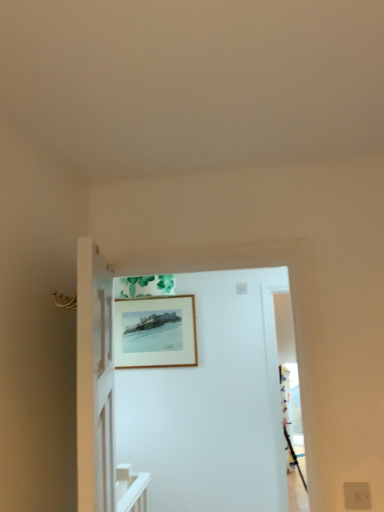
Question: Does white wooden door at center appear on the left side of white matte electric outlet at lower right?

Choices:
 (A) no
 (B) yes

Answer: (B)

Question: Considering the relative sizes of white wooden door at center and white matte electric outlet at lower right in the image provided, is white wooden door at center bigger than white matte electric outlet at lower right?

Choices:
 (A) no
 (B) yes

Answer: (B)

Question: Does white wooden door at center have a greater width compared to white matte electric outlet at lower right?

Choices:
 (A) no
 (B) yes

Answer: (B)

Question: Is white wooden door at center further to camera compared to white matte electric outlet at lower right?

Choices:
 (A) yes
 (B) no

Answer: (A)

Question: From the image's perspective, would you say white wooden door at center is shown under white matte electric outlet at lower right?

Choices:
 (A) yes
 (B) no

Answer: (B)

Question: In terms of width, does white wooden door at center look wider or thinner when compared to white matte electric outlet at lower right?

Choices:
 (A) wide
 (B) thin

Answer: (A)

Question: From the image's perspective, relative to white matte electric outlet at lower right, is white wooden door at center above or below?

Choices:
 (A) below
 (B) above

Answer: (B)

Question: Is white wooden door at center to the left or to the right of white matte electric outlet at lower right in the image?

Choices:
 (A) right
 (B) left

Answer: (B)

Question: Which is correct: white wooden door at center is inside white matte electric outlet at lower right, or outside of it?

Choices:
 (A) inside
 (B) outside

Answer: (B)

Question: From a real-world perspective, is wooden picture frame at upper center positioned above or below white wooden door at center?

Choices:
 (A) above
 (B) below

Answer: (A)

Question: Is wooden picture frame at upper center to the left or to the right of white wooden door at center in the image?

Choices:
 (A) right
 (B) left

Answer: (B)

Question: Considering the positions of wooden picture frame at upper center and white wooden door at center in the image, is wooden picture frame at upper center wider or thinner than white wooden door at center?

Choices:
 (A) thin
 (B) wide

Answer: (A)

Question: Do you think wooden picture frame at upper center is within white wooden door at center, or outside of it?

Choices:
 (A) inside
 (B) outside

Answer: (B)

Question: Looking at the image, does white matte electric outlet at lower right seem bigger or smaller compared to wooden picture frame at upper center?

Choices:
 (A) big
 (B) small

Answer: (B)

Question: Is white matte electric outlet at lower right inside the boundaries of wooden picture frame at upper center, or outside?

Choices:
 (A) outside
 (B) inside

Answer: (A)